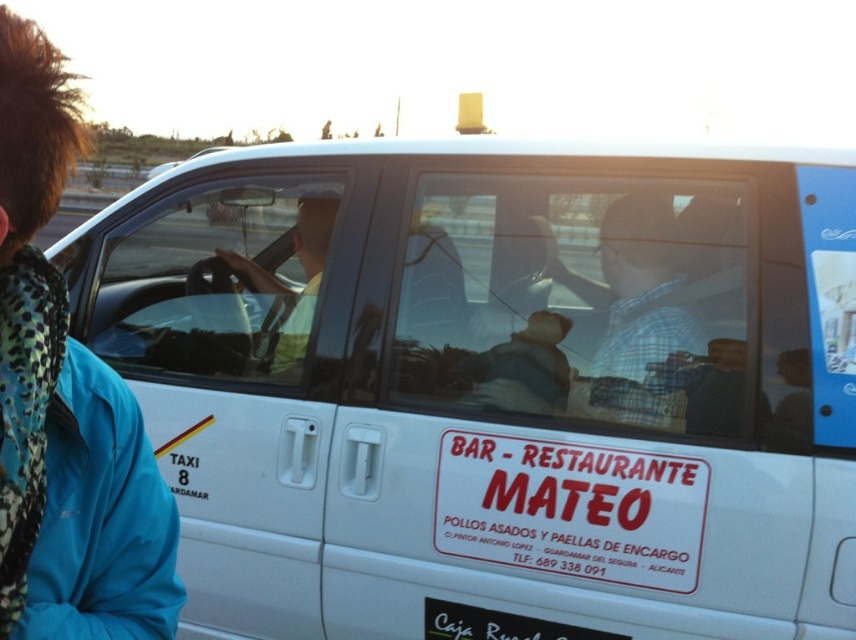
Question: Can you confirm if transparent glass at center is smaller than matte yellow shirt at center?

Choices:
 (A) yes
 (B) no

Answer: (B)

Question: In this image, where is clear glass steering wheel at center located relative to matte yellow shirt at center?

Choices:
 (A) right
 (B) left

Answer: (B)

Question: Is blue fabric jacket at left to the left of clear glass steering wheel at center from the viewer's perspective?

Choices:
 (A) no
 (B) yes

Answer: (A)

Question: Which of the following is the farthest from the observer?

Choices:
 (A) (556, 444)
 (B) (306, 292)
 (C) (155, 636)
 (D) (455, 179)

Answer: (B)

Question: Which object is positioned closest to the clear glass steering wheel at center?

Choices:
 (A) blue fabric jacket at left
 (B) white paper sign at center
 (C) matte yellow shirt at center
 (D) transparent glass at center

Answer: (C)

Question: Which of the following is the farthest from the observer?

Choices:
 (A) clear glass steering wheel at center
 (B) blue fabric jacket at left
 (C) white paper sign at center

Answer: (A)